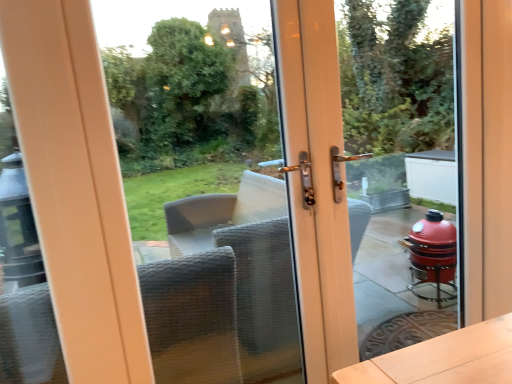
This screenshot has width=512, height=384. What do you see at coordinates (400, 172) in the screenshot?
I see `transparent glass door at center` at bounding box center [400, 172].

The width and height of the screenshot is (512, 384). What are the coordinates of `transparent glass door at center` in the screenshot? It's located at (400, 172).

You are a GUI agent. You are given a task and a screenshot of the screen. Output one action in this format:
    pyautogui.click(x=<x>, y=<y>)
    Task: Click on the transparent glass door at center
    Image resolution: width=512 pixels, height=384 pixels.
    Given the screenshot: What is the action you would take?
    pyautogui.click(x=225, y=289)

What do you see at coordinates (225, 289) in the screenshot?
I see `transparent glass door at center` at bounding box center [225, 289].

What is the approximate width of transparent glass door at center?

transparent glass door at center is 1.79 inches in width.

The height and width of the screenshot is (384, 512). I want to click on transparent glass door at center, so click(400, 172).

Can you confirm if transparent glass door at center is positioned to the right of transparent glass door at center?

No, transparent glass door at center is not to the right of transparent glass door at center.

Based on the photo, does transparent glass door at center lie in front of transparent glass door at center?

Yes, it is in front of transparent glass door at center.

Considering the positions of point (104, 66) and point (416, 304), is point (104, 66) closer or farther from the camera than point (416, 304)?

Point (104, 66) is positioned farther from the camera compared to point (416, 304).

From the image's perspective, which is above, transparent glass door at center or transparent glass door at center?

From the image's view, transparent glass door at center is above.

From a real-world perspective, which object stands above the other?

In real-world perspective, transparent glass door at center is above.

Which object is thinner, transparent glass door at center or transparent glass door at center?

With smaller width is transparent glass door at center.

Who is shorter, transparent glass door at center or transparent glass door at center?

transparent glass door at center is shorter.

Does transparent glass door at center have a larger size compared to transparent glass door at center?

Yes.

Is transparent glass door at center surrounded by transparent glass door at center?

No.

Is transparent glass door at center beside transparent glass door at center?

transparent glass door at center and transparent glass door at center are clearly separated.

Is transparent glass door at center facing away from transparent glass door at center?

No.

This screenshot has height=384, width=512. I want to click on window screen lying in front of the transparent glass door at center, so click(x=225, y=289).

Between transparent glass door at center and transparent glass door at center, which one appears on the left side from the viewer's perspective?

From the viewer's perspective, transparent glass door at center appears more on the left side.

Is transparent glass door at center in front of or behind transparent glass door at center in the image?

transparent glass door at center is behind transparent glass door at center.

Is point (368, 101) positioned before point (216, 75)?

Yes, it is in front of point (216, 75).

From the image's perspective, is transparent glass door at center positioned above or below transparent glass door at center?

Clearly, from the image's perspective, transparent glass door at center is above transparent glass door at center.

From a real-world perspective, is transparent glass door at center positioned under transparent glass door at center based on gravity?

No.

Is transparent glass door at center wider or thinner than transparent glass door at center?

Clearly, transparent glass door at center has less width compared to transparent glass door at center.

Considering the sizes of objects transparent glass door at center and transparent glass door at center in the image provided, who is taller, transparent glass door at center or transparent glass door at center?

Standing taller between the two is transparent glass door at center.

From the picture: Which of these two, transparent glass door at center or transparent glass door at center, is bigger?

transparent glass door at center.

Can transparent glass door at center be found inside transparent glass door at center?

No, transparent glass door at center is not inside transparent glass door at center.

Is transparent glass door at center positioned far away from transparent glass door at center?

Yes, transparent glass door at center is far from transparent glass door at center.

Consider the image. Is transparent glass door at center facing away from transparent glass door at center?

transparent glass door at center is not turned away from transparent glass door at center.

How different are the orientations of transparent glass door at center and transparent glass door at center in degrees?

0.000498 degrees separate the facing orientations of transparent glass door at center and transparent glass door at center.

The image size is (512, 384). I want to click on glass door above the transparent glass door at center (from the image's perspective), so click(400, 172).

Find the location of a particular element. The height and width of the screenshot is (384, 512). glass door above the transparent glass door at center (from the image's perspective) is located at coordinates (400, 172).

Where is `glass door on the right of the transparent glass door at center`? The height and width of the screenshot is (384, 512). glass door on the right of the transparent glass door at center is located at coordinates (400, 172).